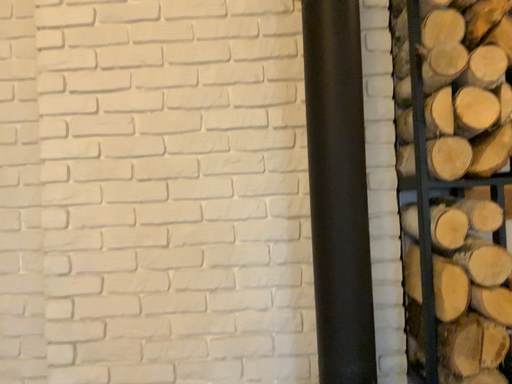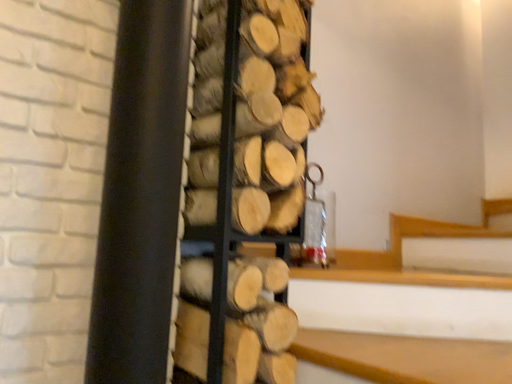
Question: Which way did the camera rotate in the video?

Choices:
 (A) rotated right
 (B) rotated left

Answer: (A)